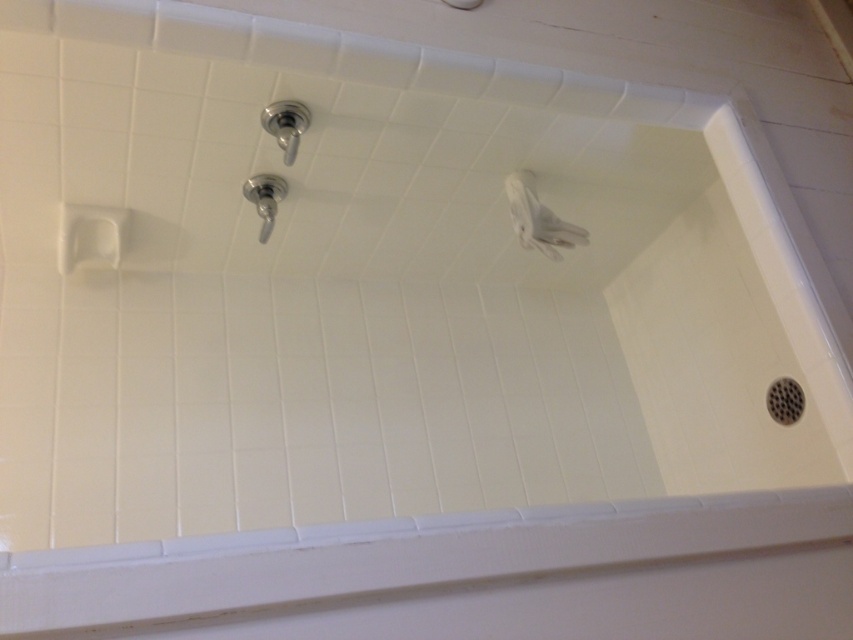
Who is lower down, satin nickel showerhead at upper center or satin nickel faucet at upper center?

satin nickel faucet at upper center

Can you confirm if satin nickel showerhead at upper center is thinner than satin nickel faucet at upper center?

Indeed, satin nickel showerhead at upper center has a lesser width compared to satin nickel faucet at upper center.

Identify the location of satin nickel showerhead at upper center. The height and width of the screenshot is (640, 853). (x=285, y=125).

This screenshot has width=853, height=640. Identify the location of satin nickel showerhead at upper center. pyautogui.click(x=285, y=125).